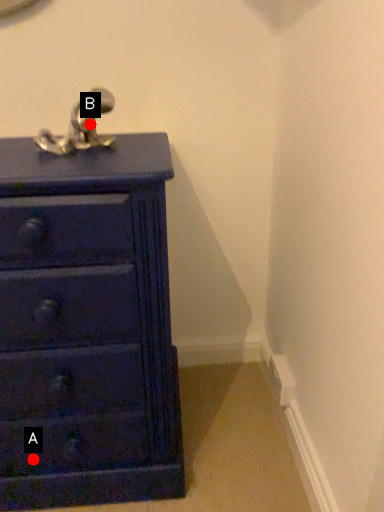
Question: Two points are circled on the image, labeled by A and B beside each circle. Which point is farther from the camera taking this photo?

Choices:
 (A) A is further
 (B) B is further

Answer: (A)